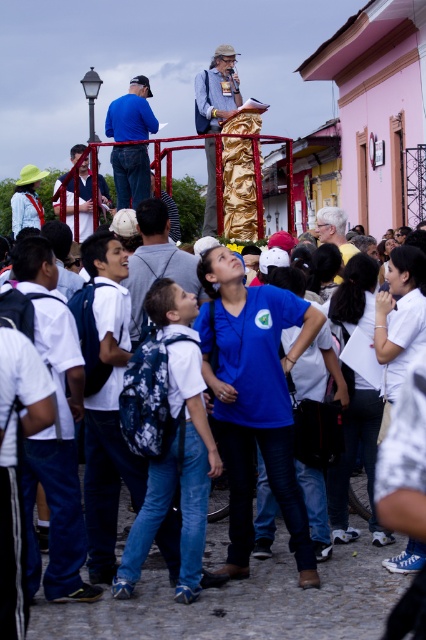
Question: Among these objects, which one is nearest to the camera?

Choices:
 (A) blue backpack at center
 (B) matte black shirt at center
 (C) denim jacket at upper center

Answer: (A)

Question: From the image, what is the correct spatial relationship of blue backpack at center in relation to gray hair at center?

Choices:
 (A) above
 (B) below

Answer: (B)

Question: Which of the following is the closest to the observer?

Choices:
 (A) (210, 96)
 (B) (350, 248)
 (C) (81, 164)
 (D) (129, 173)

Answer: (B)

Question: Does white backpack at center come behind blue backpack at center?

Choices:
 (A) no
 (B) yes

Answer: (A)

Question: Can you confirm if blue denim jeans at left is positioned below matte black shirt at center?

Choices:
 (A) yes
 (B) no

Answer: (A)

Question: Among these objects, which one is farthest from the camera?

Choices:
 (A) gray hair at center
 (B) white backpack at center
 (C) blue backpack at center
 (D) matte black shirt at center

Answer: (D)